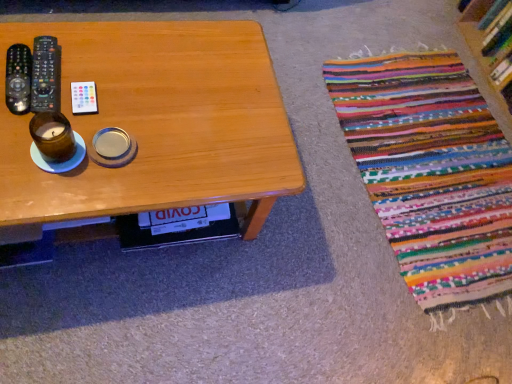
In order to click on free space to the right of black plastic remote control at left, positioned as the 3th remote control in right-to-left order in this screenshot , I will do `click(106, 100)`.